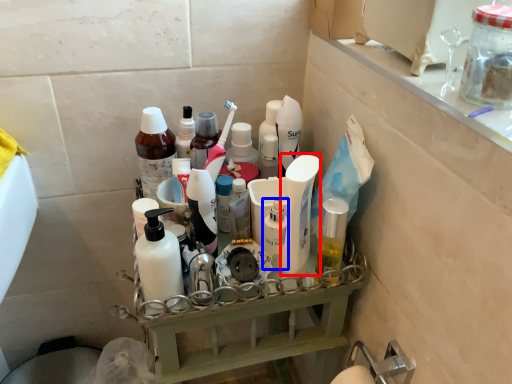
Question: Which object is further to the camera taking this photo, cleaning product (highlighted by a red box) or toiletry (highlighted by a blue box)?

Choices:
 (A) cleaning product
 (B) toiletry

Answer: (B)